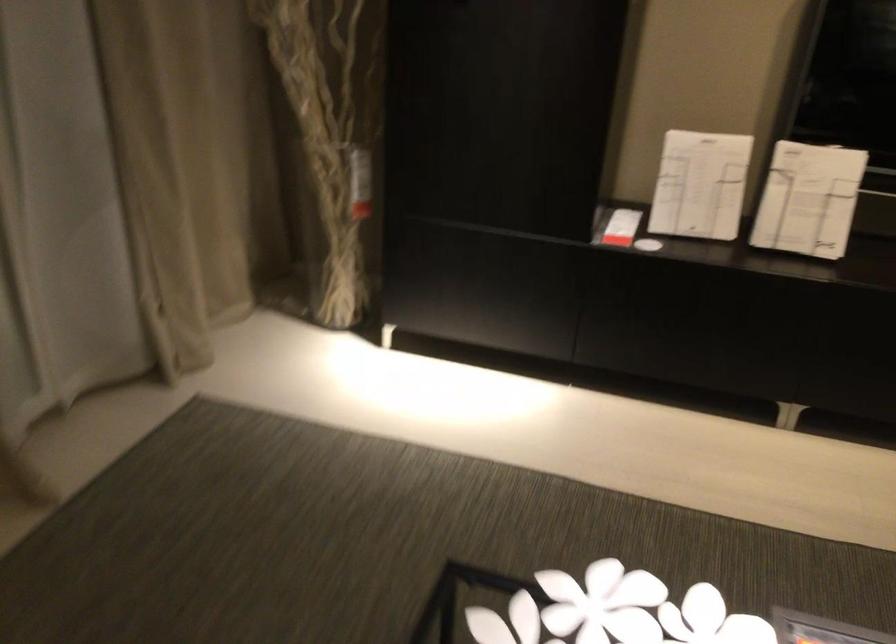
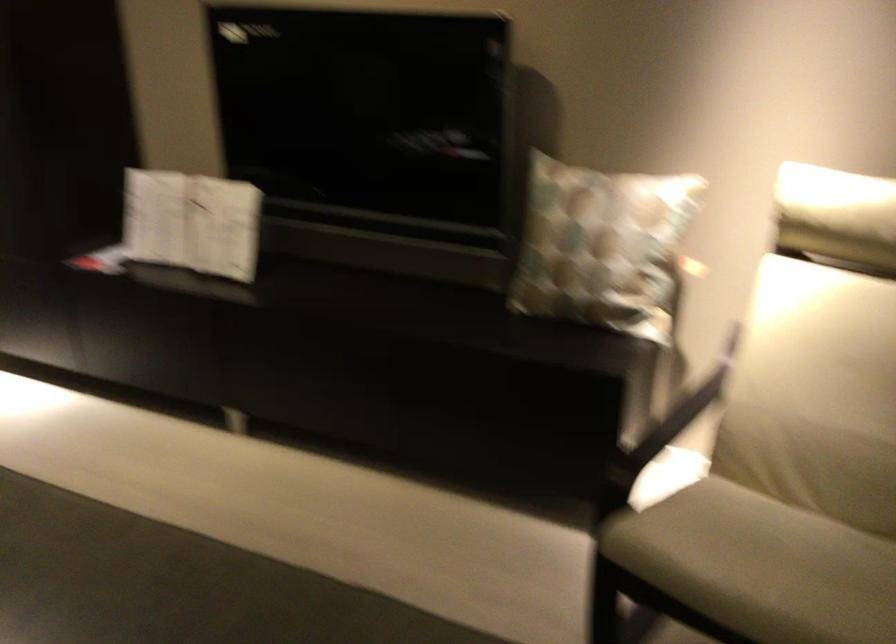
Question: The images are taken continuously from a first-person perspective. In which direction are you moving?

Choices:
 (A) Left
 (B) Right
 (C) Forward
 (D) Backward

Answer: (B)